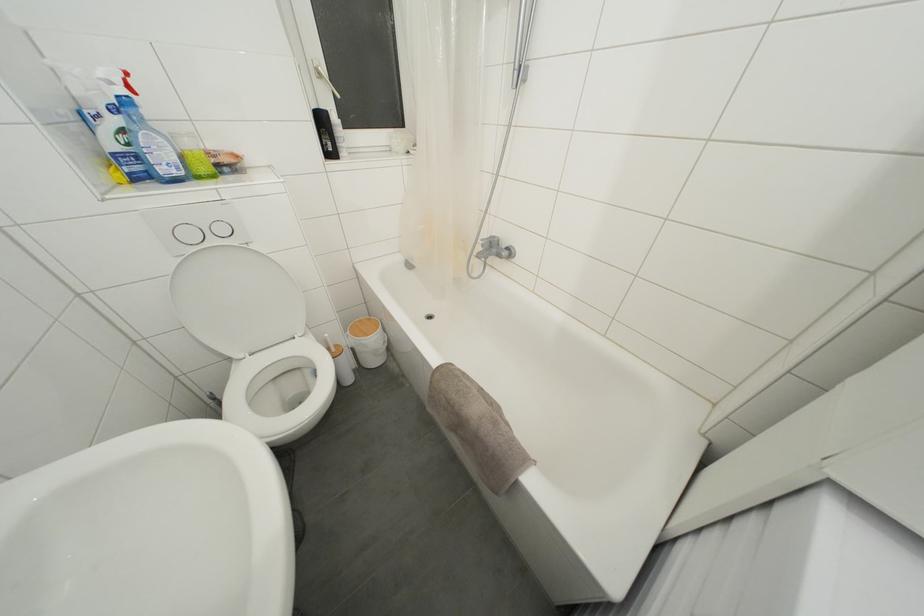
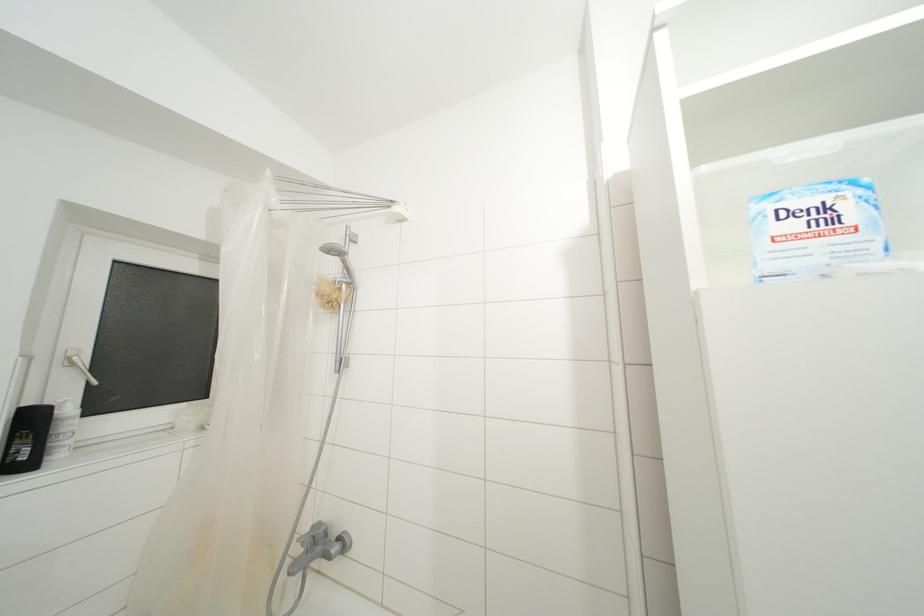
Consider the image. First-person continuous shooting, in which direction is the camera rotating?

The camera rotated toward right-up.